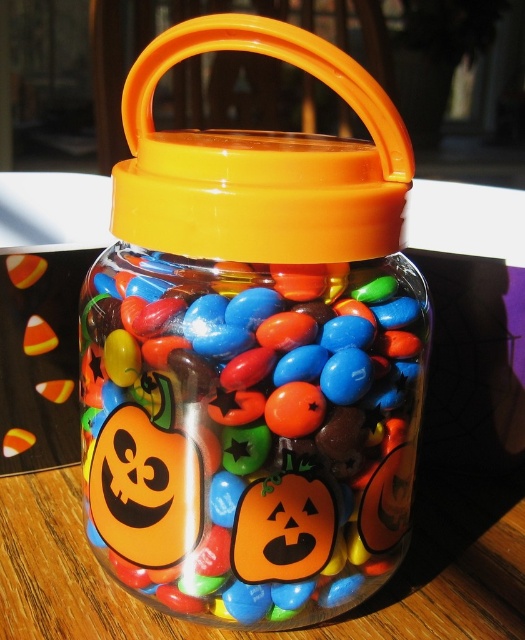
Can you confirm if glossy plastic jar at center is positioned below orange plastic handle at upper center?

Yes.

Is point (112, 248) farther from viewer compared to point (275, 244)?

Yes, it is behind point (275, 244).

Between point (235, 608) and point (278, 195), which one is positioned behind?

The point (235, 608) is behind.

You are a GUI agent. You are given a task and a screenshot of the screen. Output one action in this format:
    pyautogui.click(x=<x>, y=<y>)
    Task: Click on the glossy plastic jar at center
    The height and width of the screenshot is (640, 525).
    Given the screenshot: What is the action you would take?
    pyautogui.click(x=250, y=429)